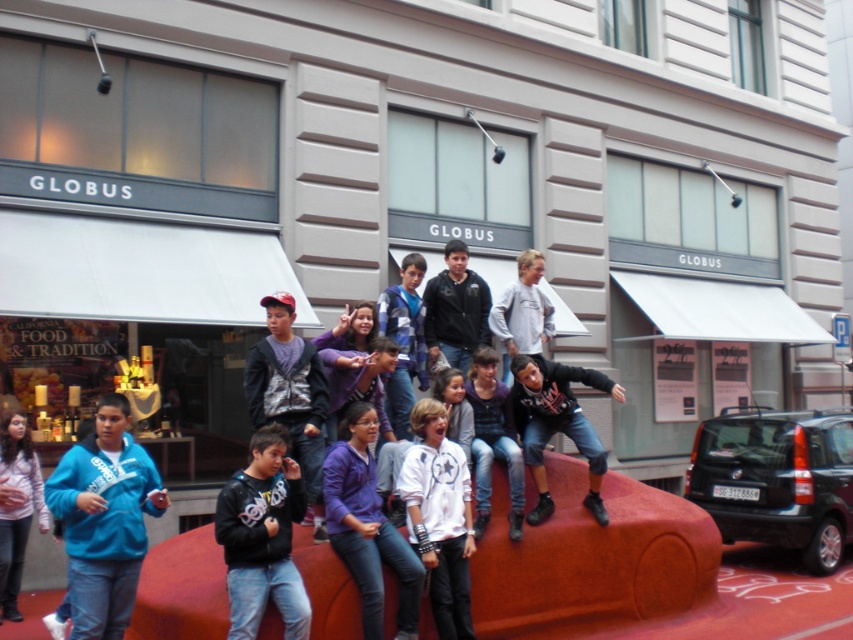
You are a photographer trying to capture the group of children at the Globus store entrance. You notice two clothing items in the center of the scene. Which clothing item is positioned to the right of the other? The two items are the black leather jacket at center and the dark gray hoodie at center.

The black leather jacket at center is to the right of the dark gray hoodie at center.

You are taking a photo of the Globus store scene. You notice two points in the image labeled as point 1 at coordinates point [254,625] and point 2 at coordinates point [244,381]. Which point is closer to the camera?

Point [254,625] is closer to the camera than point [244,381].

You are a photographer trying to capture a group photo of the children at the Globus store. You notice the blue fleece jacket at lower left and the black matte hoodie at center. Which child should you ask to move closer to the front so that both jackets are visible in the photo?

The blue fleece jacket at lower left has a smaller size compared to black matte hoodie at center, so you should ask the child wearing the blue fleece jacket at lower left to move closer to the front to ensure both are visible.